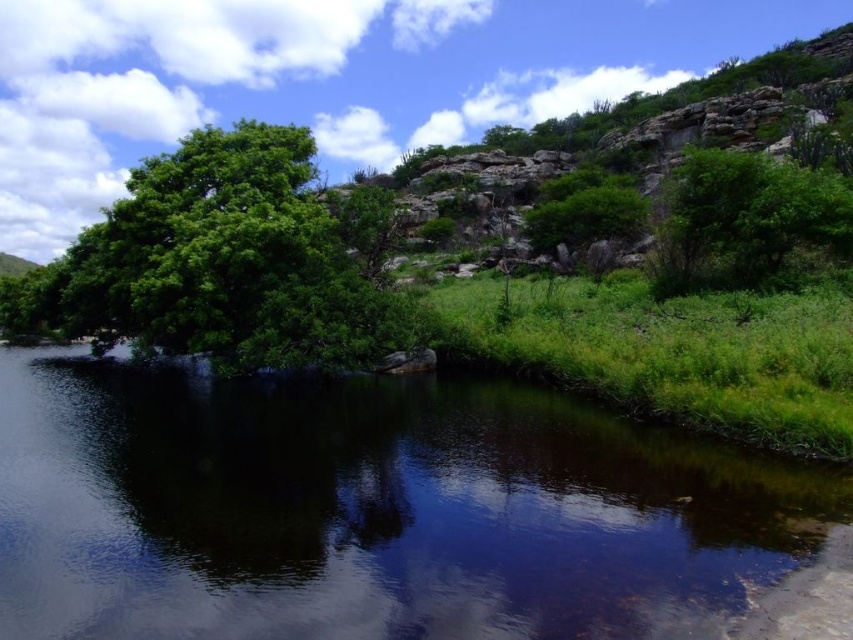
Question: Does green grassy river at center appear on the left side of green leafy tree at left?

Choices:
 (A) yes
 (B) no

Answer: (B)

Question: Where is green grassy river at center located in relation to green leafy bush at upper right in the image?

Choices:
 (A) above
 (B) below

Answer: (B)

Question: Which object appears farthest from the camera in this image?

Choices:
 (A) green leafy bush at upper right
 (B) green grassy river at center

Answer: (A)

Question: Does green grassy river at center have a lesser width compared to green leafy bush at upper right?

Choices:
 (A) yes
 (B) no

Answer: (B)

Question: Which point appears closest to the camera in this image?

Choices:
 (A) (703, 250)
 (B) (49, 349)
 (C) (379, 344)

Answer: (C)

Question: Which point appears farthest from the camera in this image?

Choices:
 (A) (456, 545)
 (B) (839, 225)

Answer: (B)